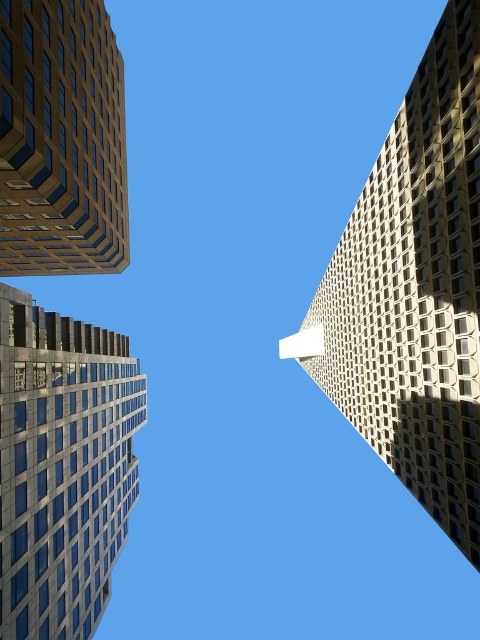
Question: Considering the relative positions of beige textured building at right and matte glass building at upper left in the image provided, where is beige textured building at right located with respect to matte glass building at upper left?

Choices:
 (A) right
 (B) left

Answer: (A)

Question: Can you confirm if beige textured building at right is positioned above metallic glass skyscraper at center?

Choices:
 (A) yes
 (B) no

Answer: (A)

Question: Is metallic glass skyscraper at center above matte glass building at upper left?

Choices:
 (A) yes
 (B) no

Answer: (B)

Question: Considering the real-world distances, which object is closest to the matte glass building at upper left?

Choices:
 (A) beige textured building at right
 (B) metallic glass skyscraper at center

Answer: (B)

Question: Which object is positioned farthest from the beige textured building at right?

Choices:
 (A) metallic glass skyscraper at center
 (B) matte glass building at upper left

Answer: (B)

Question: Which object is positioned closest to the beige textured building at right?

Choices:
 (A) matte glass building at upper left
 (B) metallic glass skyscraper at center

Answer: (B)